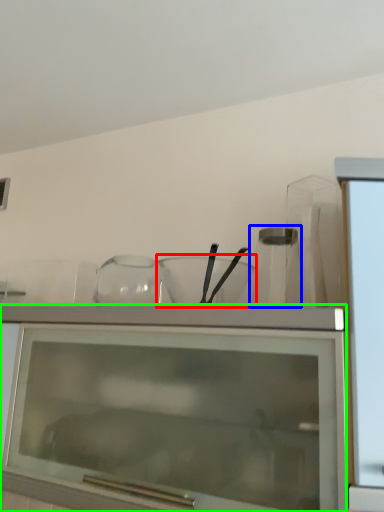
Question: Considering the real-world distances, which object is closest to mixing bowl (highlighted by a red box)? glass vase (highlighted by a blue box) or cabinetry (highlighted by a green box).

Choices:
 (A) glass vase
 (B) cabinetry

Answer: (A)